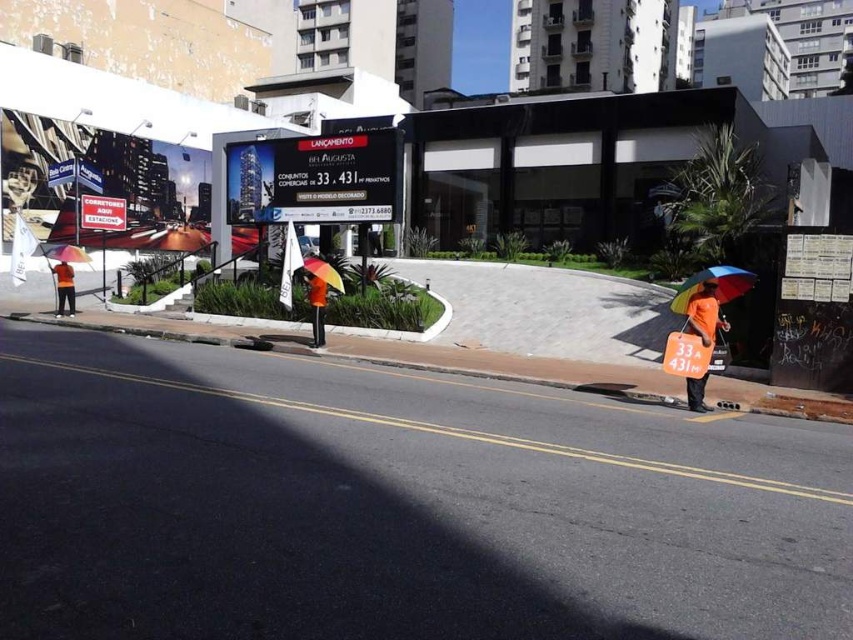
Who is positioned more to the left, orange fabric umbrella at lower right or rainbow fabric umbrella at center?

Positioned to the left is rainbow fabric umbrella at center.

Does orange fabric umbrella at lower right have a greater width compared to rainbow fabric umbrella at center?

In fact, orange fabric umbrella at lower right might be narrower than rainbow fabric umbrella at center.

Locate an element on the screen. orange fabric umbrella at lower right is located at coordinates (705, 314).

Looking at this image, is matte black signboard at center bigger than rainbow fabric umbrella at center?

No.

Does matte black signboard at center have a greater width compared to rainbow fabric umbrella at center?

In fact, matte black signboard at center might be narrower than rainbow fabric umbrella at center.

Does point (231, 168) come farther from viewer compared to point (328, 282)?

Yes, point (231, 168) is behind point (328, 282).

Identify the location of matte black signboard at center. (314, 179).

Does point (712, 332) lie in front of point (323, 301)?

Yes, it is in front of point (323, 301).

Can you confirm if orange fabric umbrella at lower right is thinner than orange reflective vest at center?

Incorrect, orange fabric umbrella at lower right's width is not less than orange reflective vest at center's.

Does point (697, 301) come behind point (312, 324)?

No, (697, 301) is in front of (312, 324).

The width and height of the screenshot is (853, 640). Identify the location of orange fabric umbrella at lower right. (705, 314).